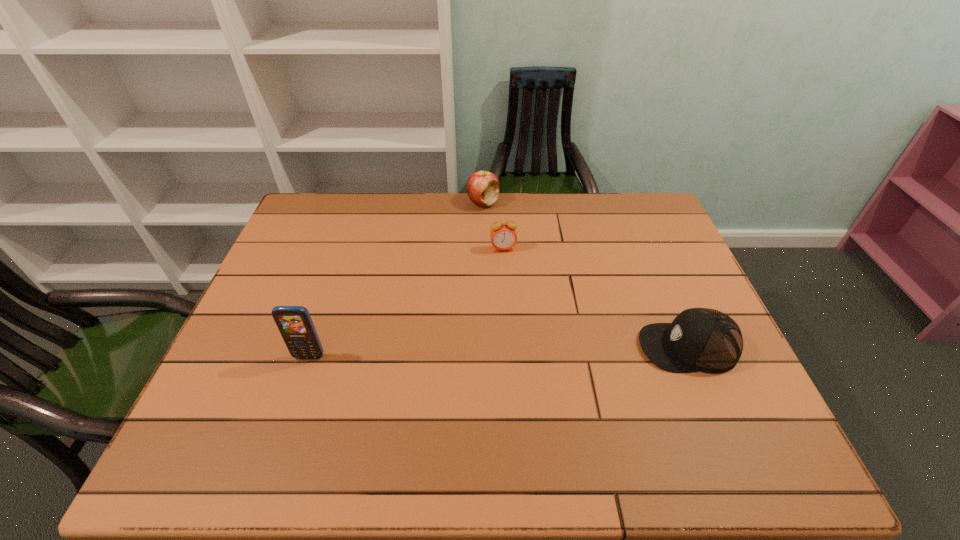
You are a GUI agent. You are given a task and a screenshot of the screen. Output one action in this format:
    pyautogui.click(x=<x>, y=<y>)
    Task: Click on the vacant area between the tallest object and the cap
    The width and height of the screenshot is (960, 540).
    Given the screenshot: What is the action you would take?
    pyautogui.click(x=498, y=352)

Where is `the third closest object to the apple`? the third closest object to the apple is located at coordinates click(295, 325).

This screenshot has width=960, height=540. What are the coordinates of `the third closest object to the leftmost object` in the screenshot? It's located at (699, 339).

Locate an element on the screen. The height and width of the screenshot is (540, 960). blank area in the image that satisfies the following two spatial constraints: 1. on the front side of the apple; 2. on the front-facing side of the cap is located at coordinates (484, 347).

Find the location of a particular element. The width and height of the screenshot is (960, 540). free location that satisfies the following two spatial constraints: 1. on the front side of the alarm clock; 2. on the front-facing side of the rightmost object is located at coordinates (509, 347).

Identify the location of free space that satisfies the following two spatial constraints: 1. on the front side of the alarm clock; 2. on the front-facing side of the rightmost object. The width and height of the screenshot is (960, 540). (509, 347).